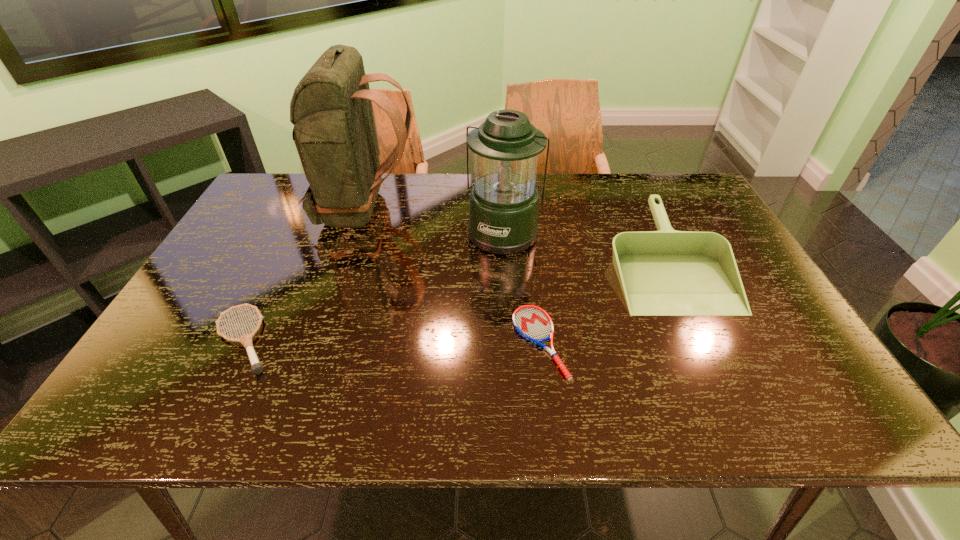
Locate an element on the screen. vacant region at the right edge of the desktop is located at coordinates (684, 230).

What are the coordinates of `vacant area that lies between the fourth shortest object and the tallest object` in the screenshot? It's located at (435, 220).

Where is `unoccupied position between the lantern and the dustpan`? The image size is (960, 540). unoccupied position between the lantern and the dustpan is located at coordinates (585, 247).

This screenshot has width=960, height=540. I want to click on free spot between the shorter tennis racket and the left tennis racket, so click(x=393, y=341).

Locate an element on the screen. Image resolution: width=960 pixels, height=540 pixels. free space between the backpack and the second shortest object is located at coordinates (305, 274).

Where is `free space between the right tennis racket and the backpack`? free space between the right tennis racket and the backpack is located at coordinates (452, 275).

Identify the location of free space between the shortest object and the second tallest object. The image size is (960, 540). (522, 287).

Find the location of a particular element. The image size is (960, 540). vacant area that lies between the backpack and the second tallest object is located at coordinates (435, 220).

What are the coordinates of `free spot between the taller tennis racket and the shortest object` in the screenshot? It's located at click(393, 341).

Identify the location of the third closest object relative to the third tallest object. The image size is (960, 540). (334, 131).